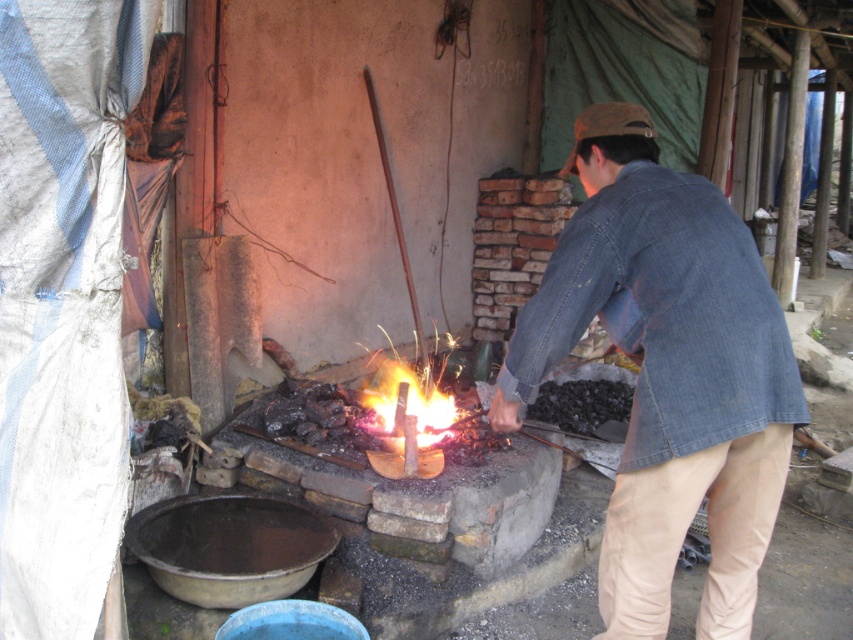
Question: Which point is closer to the camera?

Choices:
 (A) (641, 248)
 (B) (407, 374)

Answer: (A)

Question: Does denim jacket at center appear on the right side of flaming hot steel at center?

Choices:
 (A) no
 (B) yes

Answer: (B)

Question: Can you confirm if denim jacket at center is smaller than flaming hot steel at center?

Choices:
 (A) yes
 (B) no

Answer: (B)

Question: Can you confirm if denim jacket at center is positioned below flaming hot steel at center?

Choices:
 (A) yes
 (B) no

Answer: (B)

Question: Which point is closer to the camera taking this photo?

Choices:
 (A) coord(386,417)
 (B) coord(730,483)

Answer: (B)

Question: Which point is farther to the camera?

Choices:
 (A) (685, 468)
 (B) (386, 404)

Answer: (B)